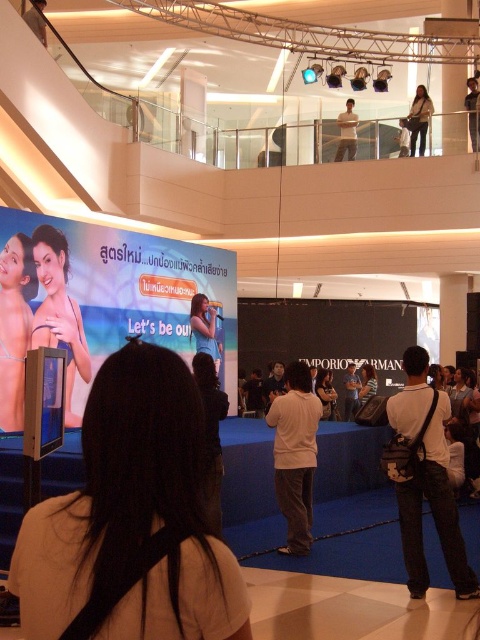
Question: Is light beige backpack at center to the right of matte blue shirt at center from the viewer's perspective?

Choices:
 (A) no
 (B) yes

Answer: (B)

Question: Which object is positioned closest to the matte black dress at center?

Choices:
 (A) matte blue shirt at center
 (B) light beige backpack at center
 (C) matte black bikini at left
 (D) matte white shirt at center

Answer: (D)

Question: Among these objects, which one is nearest to the camera?

Choices:
 (A) light beige backpack at center
 (B) matte blue shirt at center
 (C) matte black jacket at upper right
 (D) matte black bikini at left

Answer: (A)

Question: Does matte black bikini at left appear under matte blue shirt at center?

Choices:
 (A) no
 (B) yes

Answer: (A)

Question: Is the position of light beige backpack at center less distant than that of matte black dress at center?

Choices:
 (A) yes
 (B) no

Answer: (A)

Question: Among these objects, which one is farthest from the camera?

Choices:
 (A) matte black dress at center
 (B) light beige backpack at center
 (C) matte black jacket at upper right
 (D) matte white shirt at center

Answer: (C)